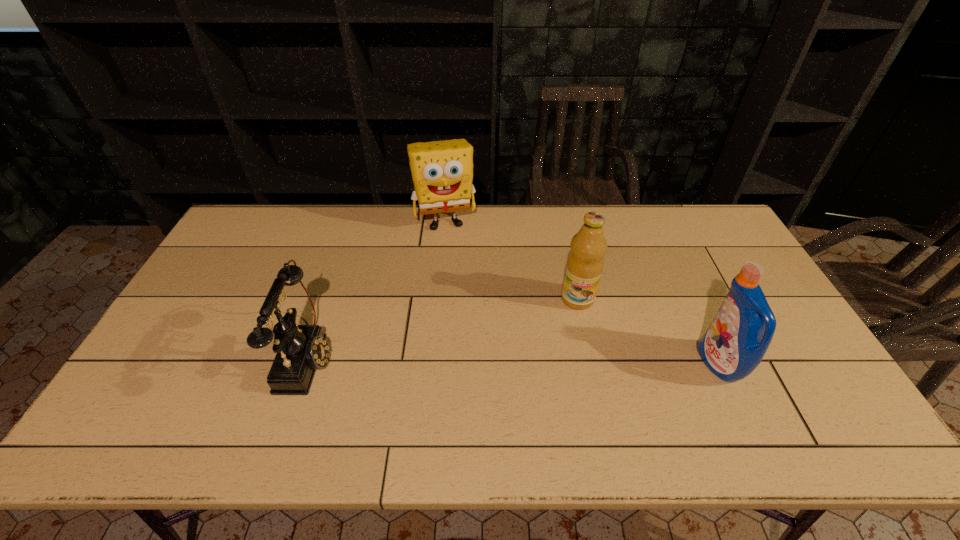
I want to click on the leftmost object, so click(301, 349).

Where is `telephone`? This screenshot has width=960, height=540. telephone is located at coordinates (301, 349).

Where is `detergent`? detergent is located at coordinates (734, 344).

Where is `the third object from left to right`? This screenshot has height=540, width=960. the third object from left to right is located at coordinates point(584,266).

Identify the location of the third nearest object. Image resolution: width=960 pixels, height=540 pixels. (584, 266).

Identify the location of sponge. The height and width of the screenshot is (540, 960). (442, 171).

Find the location of a particular element. the third object from right to left is located at coordinates (442, 171).

Find the location of a particular element. This screenshot has width=960, height=540. free space located 0.340m on the dial of the leftmost object is located at coordinates (460, 356).

Locate an element on the screen. This screenshot has width=960, height=540. vacant space located on the label of the detergent is located at coordinates (550, 364).

I want to click on free space located 0.250m on the label of the detergent, so click(x=607, y=364).